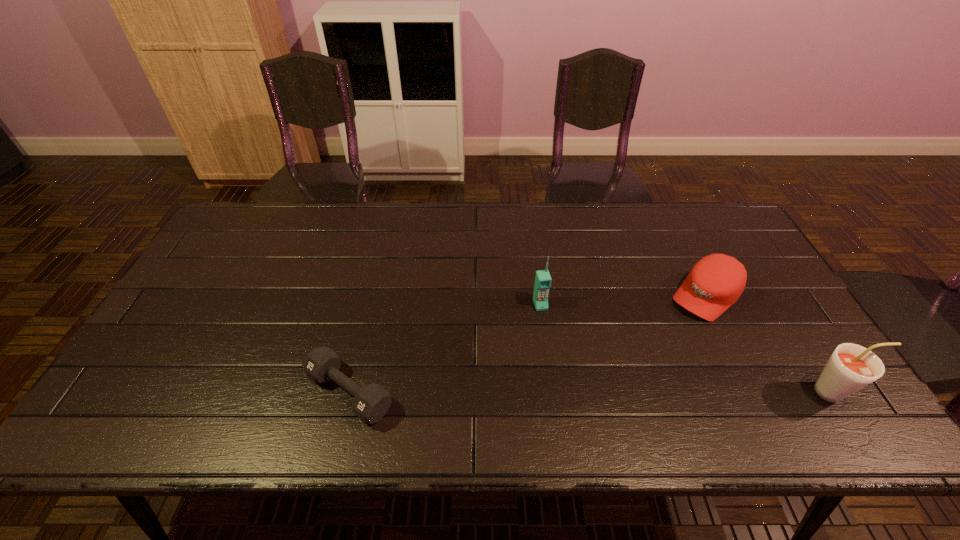
This screenshot has height=540, width=960. I want to click on free space on the desktop that is between the leftmost object and the root beer and is positioned on the front-facing side of the third tallest object, so click(x=608, y=392).

Locate an element on the screen. The image size is (960, 540). vacant space on the desktop that is between the dumbbell and the root beer and is positioned on the keypad of the cellular telephone is located at coordinates (568, 392).